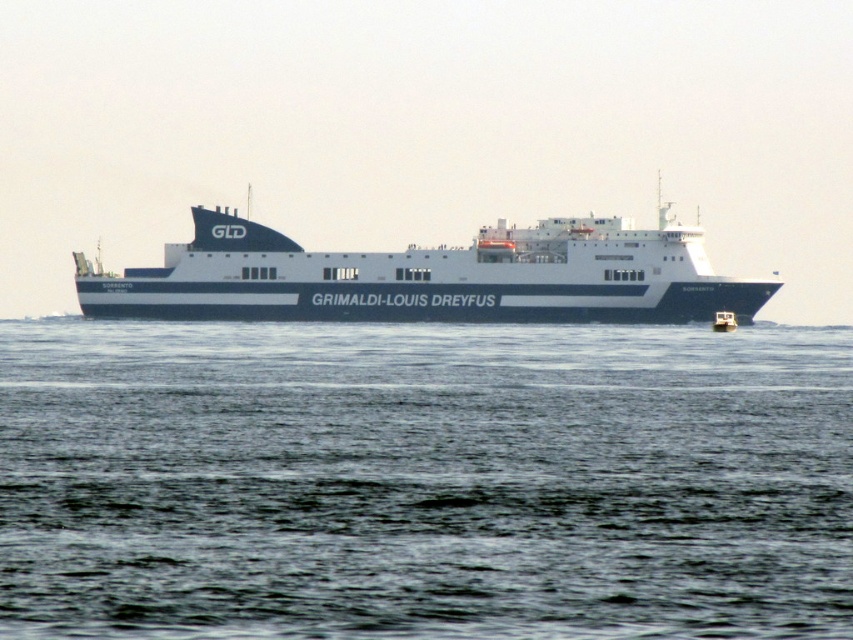
Can you confirm if blue water at center is shorter than white matte ferry at center?

Correct, blue water at center is not as tall as white matte ferry at center.

Is blue water at center to the left of white matte ferry at center from the viewer's perspective?

Correct, you'll find blue water at center to the left of white matte ferry at center.

Between point (254, 380) and point (433, 282), which one is positioned behind?

The point (433, 282) is more distant.

Locate an element on the screen. Image resolution: width=853 pixels, height=640 pixels. blue water at center is located at coordinates coord(422,481).